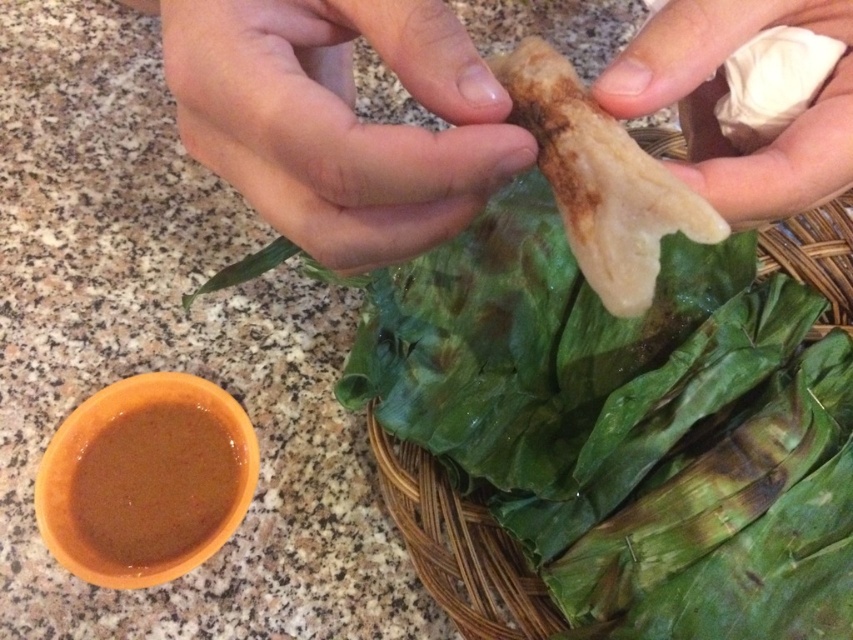
You are a food photographer setting up a shot of the dumplings. You have two points marked on your screen for focus. The first point is at coordinate point (439,515) and the second is at point (614,288). Which point should you focus on to capture the closest object in the scene?

Point (439,515) is further to the viewer than point (614,288), so you should focus on point (439,515) to capture the closest object in the scene.

You are a food photographer setting up a shot of the dumplings. You need to adjust the lighting so that both the white matte paper towel at upper right and the brown matte sauce at lower left are evenly lit. Which object should you move closer to the light source to achieve this?

The white matte paper towel at upper right is closer to the viewer than the brown matte sauce at lower left. Since it is already closer, moving it further away might not help. Alternatively, moving the brown matte sauce at lower left closer to the light source could balance the lighting. However, based on the given spatial relationship, adjusting the light direction towards the brown matte sauce at lower left would be more effective without moving objects.

You are setting up a dining table and need to place both the white matte paper towel at upper right and the brown matte sauce at lower left. According to the image, where should you place each item relative to each other?

The white matte paper towel at upper right should be placed on the right side of the brown matte sauce at lower left, as it is positioned to the right of it in the image.